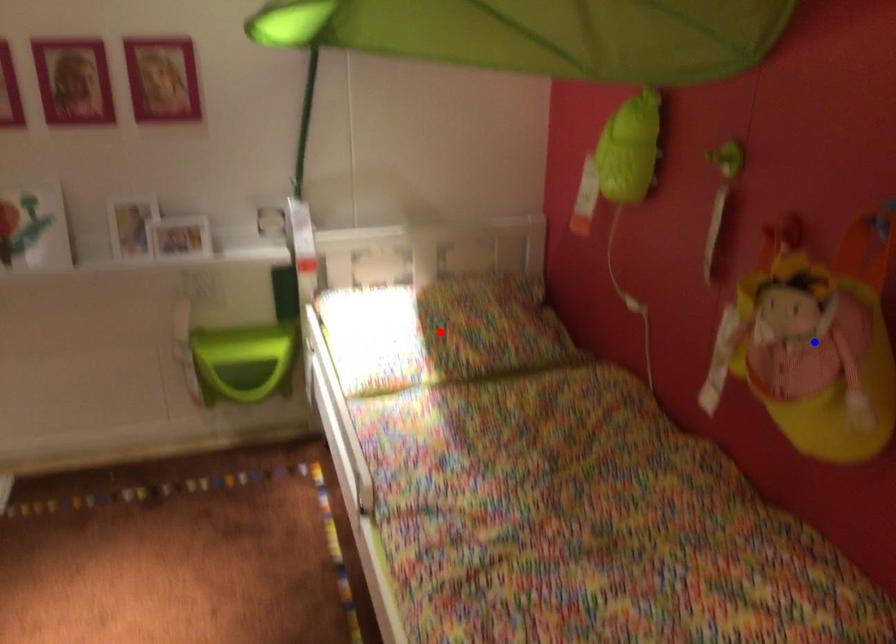
Question: Which of the two points in the image is closer to the camera?

Choices:
 (A) Blue point is closer.
 (B) Red point is closer.

Answer: (A)